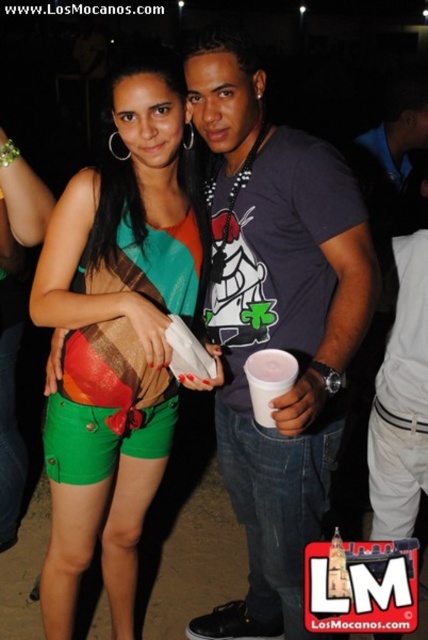
You are at a party and want to grab the white plastic cup at center without moving the green cotton shorts at lower left. Is this possible?

The white plastic cup at center is behind the green cotton shorts at lower left, so you can reach it without moving the green cotton shorts at lower left because it is positioned behind it.